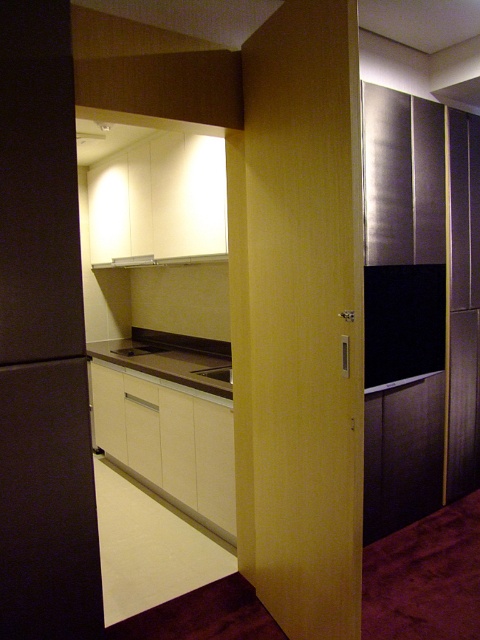
Question: Which object is closer to the camera taking this photo?

Choices:
 (A) brown laminate countertop at center
 (B) matte gray sink at center

Answer: (A)

Question: Can you confirm if brown laminate countertop at center is wider than matte gray sink at center?

Choices:
 (A) no
 (B) yes

Answer: (B)

Question: Among these points, which one is nearest to the camera?

Choices:
 (A) (225, 374)
 (B) (168, 353)

Answer: (A)

Question: Is brown laminate countertop at center to the right of matte gray sink at center from the viewer's perspective?

Choices:
 (A) yes
 (B) no

Answer: (B)

Question: Which object is closer to the camera taking this photo?

Choices:
 (A) matte gray sink at center
 (B) brown laminate countertop at center

Answer: (B)

Question: Can you confirm if brown laminate countertop at center is wider than matte gray sink at center?

Choices:
 (A) no
 (B) yes

Answer: (B)